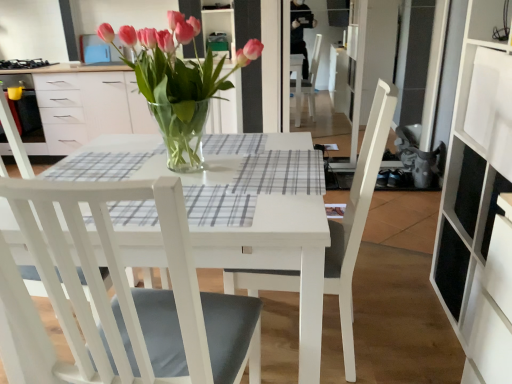
The height and width of the screenshot is (384, 512). What are the coordinates of `vacant location below pink glass vase at center (from a real-world perspective)` in the screenshot? It's located at (199, 163).